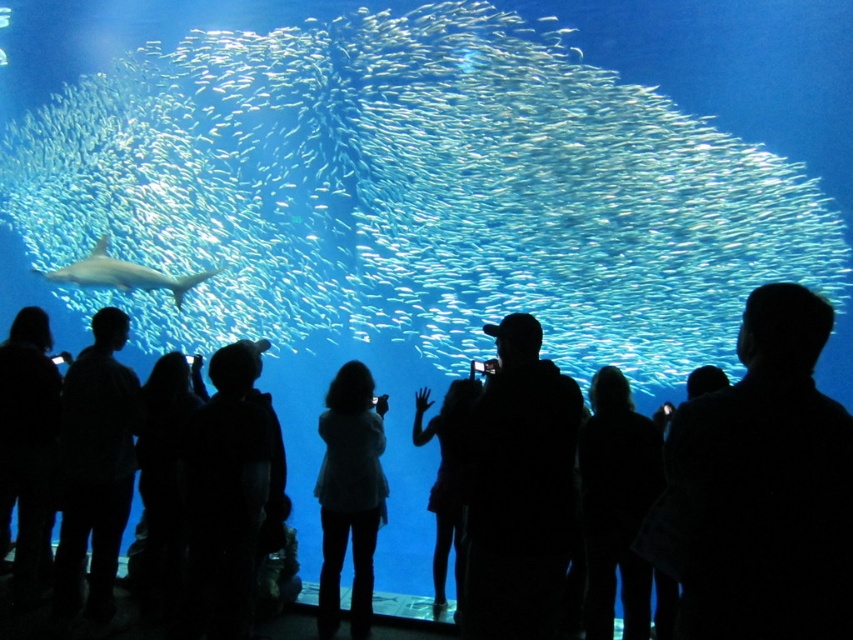
Can you confirm if black matte person at upper right is wider than silhouette dress at center?

Indeed, black matte person at upper right has a greater width compared to silhouette dress at center.

Does black matte person at upper right have a lesser height compared to silhouette dress at center?

Indeed, black matte person at upper right has a lesser height compared to silhouette dress at center.

Between point (729, 608) and point (462, 460), which one is positioned in front?

Point (729, 608) is in front.

Where is `black matte person at upper right`? Image resolution: width=853 pixels, height=640 pixels. black matte person at upper right is located at coordinates (763, 486).

Between silhouette hair at center and white matte shirt at center, which one is positioned lower?

white matte shirt at center is below.

Between point (583, 620) and point (337, 547), which one is positioned in front?

Point (583, 620) is in front.

Locate an element on the screen. The height and width of the screenshot is (640, 853). silhouette hair at center is located at coordinates (614, 504).

Does point (746, 544) come in front of point (782, 540)?

No, it is not.

Is black matte person at center wider than black matte person at upper right?

Indeed, black matte person at center has a greater width compared to black matte person at upper right.

Find the location of a particular element. The image size is (853, 640). black matte person at center is located at coordinates (762, 486).

Identify the location of black matte person at center. (762, 486).